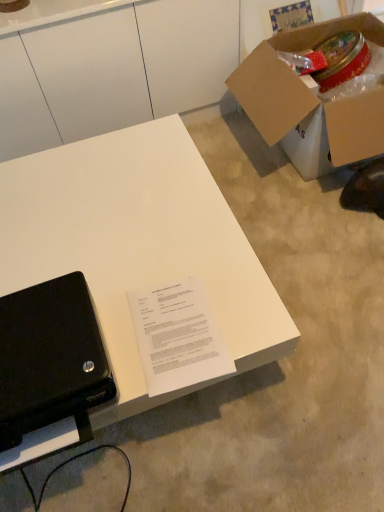
Identify the location of vacant area that is situated to the right of white matte desk at lower left. (310, 293).